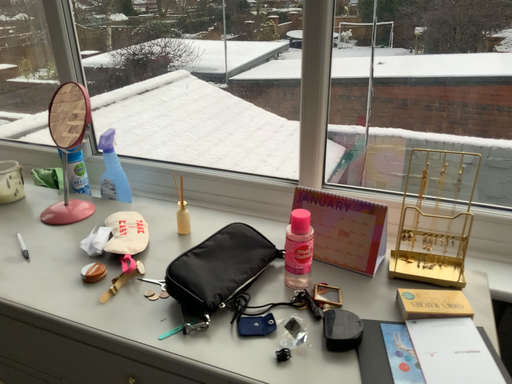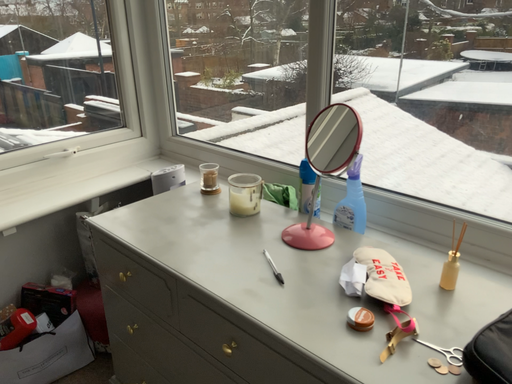
Question: How did the camera likely rotate when shooting the video?

Choices:
 (A) rotated left
 (B) rotated right

Answer: (A)